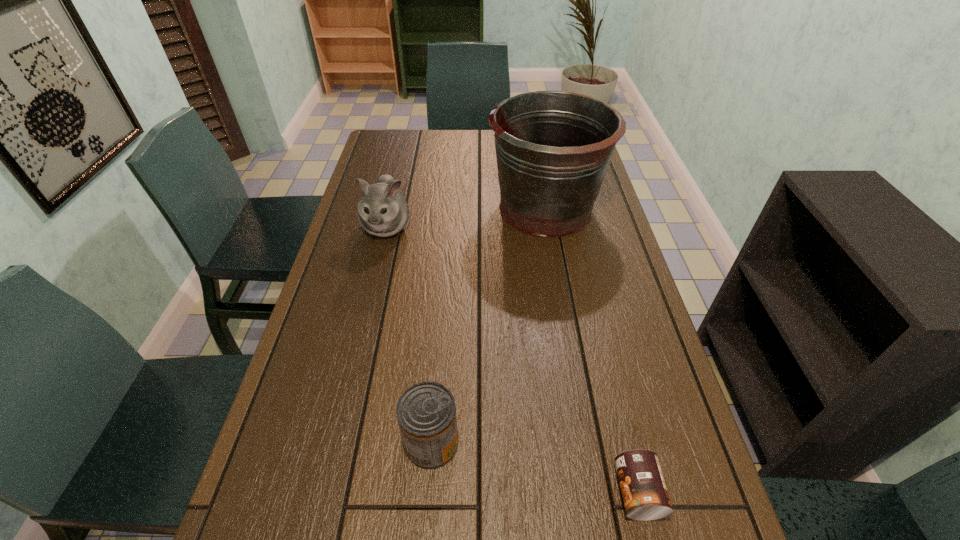
Image resolution: width=960 pixels, height=540 pixels. Find the location of `object that stands as the third closest to the leftmost object`. object that stands as the third closest to the leftmost object is located at coordinates (645, 496).